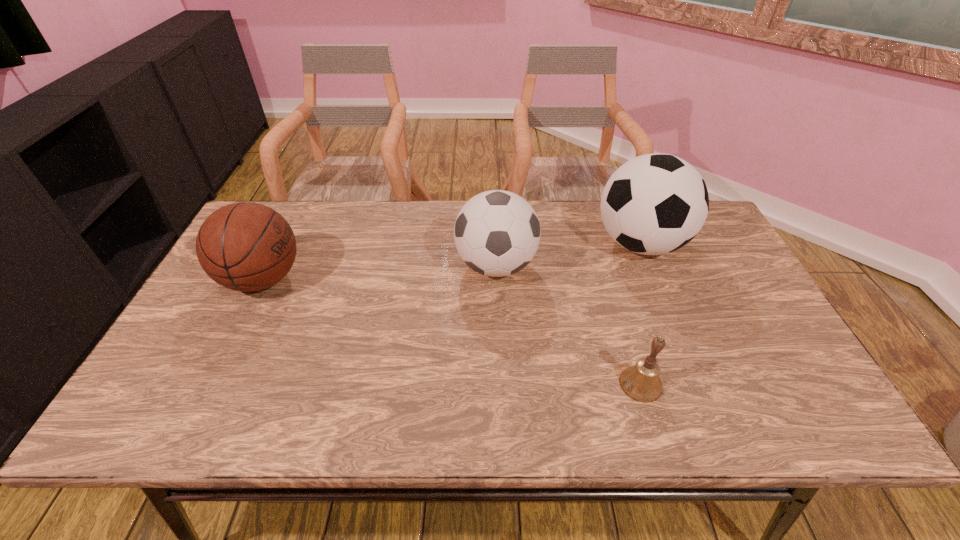
Find the location of `free region located 0.320m on the right of the bell`. free region located 0.320m on the right of the bell is located at coordinates (804, 384).

Image resolution: width=960 pixels, height=540 pixels. I want to click on object situated at the near edge, so click(x=641, y=382).

Identify the location of object that is at the left edge. (244, 246).

The height and width of the screenshot is (540, 960). I want to click on object present at the right edge, so click(654, 204).

Where is `object at the far right corner`? object at the far right corner is located at coordinates (654, 204).

In the image, there is a desktop. Where is `vacant region at the far edge`? vacant region at the far edge is located at coordinates (320, 211).

This screenshot has width=960, height=540. What are the coordinates of `free location at the near edge` in the screenshot? It's located at (710, 412).

Locate an element on the screen. This screenshot has height=540, width=960. vacant area at the left edge is located at coordinates (206, 351).

Find the location of a particular element. The width and height of the screenshot is (960, 540). vacant point located between the shorter soccer ball and the shortest object is located at coordinates (568, 325).

The height and width of the screenshot is (540, 960). Find the location of `vacant area between the basketball and the nearest object`. vacant area between the basketball and the nearest object is located at coordinates (452, 332).